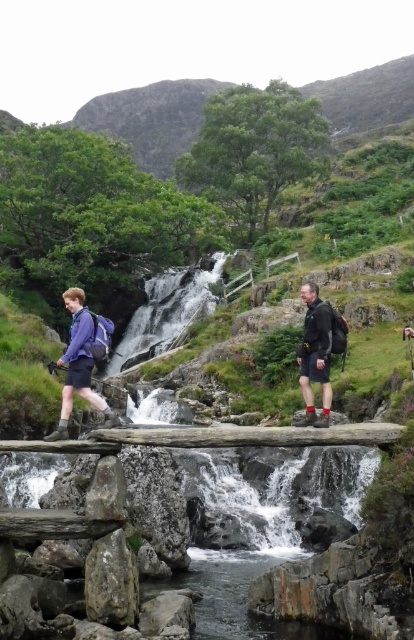
Which of these two, matte purple jacket at left or matte black backpack at center, stands shorter?

matte black backpack at center

Does matte purple jacket at left have a smaller size compared to matte black backpack at center?

Actually, matte purple jacket at left might be larger than matte black backpack at center.

Image resolution: width=414 pixels, height=640 pixels. What are the coordinates of `matte purple jacket at left` in the screenshot? It's located at (82, 360).